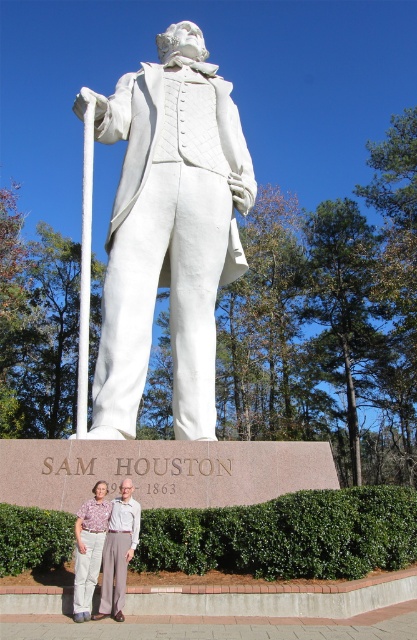
Can you confirm if white marble statue at center is shorter than light brown fabric pants at lower center?

No, white marble statue at center is not shorter than light brown fabric pants at lower center.

Between white marble statue at center and light brown fabric pants at lower center, which one has less height?

light brown fabric pants at lower center is shorter.

Does point (158, 100) come closer to viewer compared to point (80, 529)?

No, (158, 100) is further to viewer.

At what (x,y) coordinates should I click in order to perform the action: click on white marble statue at center. Please return your answer as a coordinate pair (x, y). Looking at the image, I should click on (170, 230).